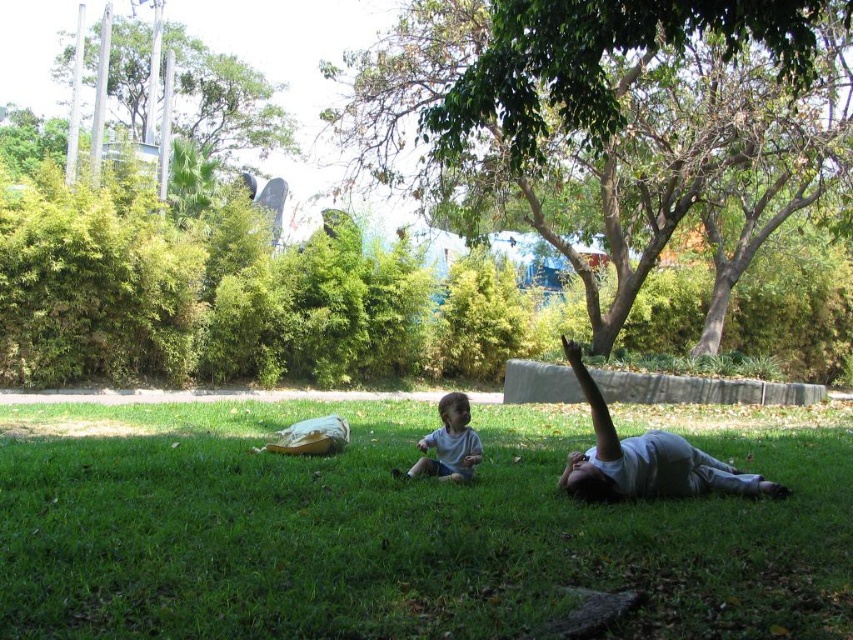
You are a photographer standing in the park and want to take a photo that includes both point (718, 60) and point (595, 420). Which point is closer to you so that you can focus on it first?

Point (718, 60) is closer to you than point (595, 420), so you can focus on it first.